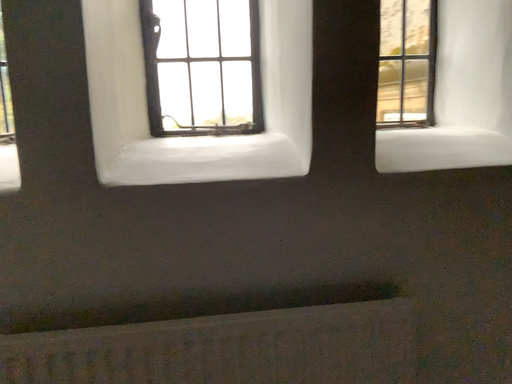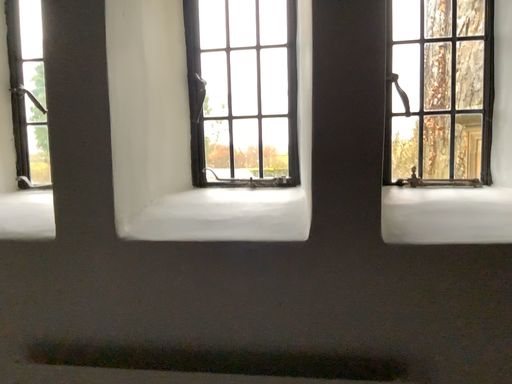
Question: How did the camera likely rotate when shooting the video?

Choices:
 (A) rotated left
 (B) rotated right

Answer: (A)